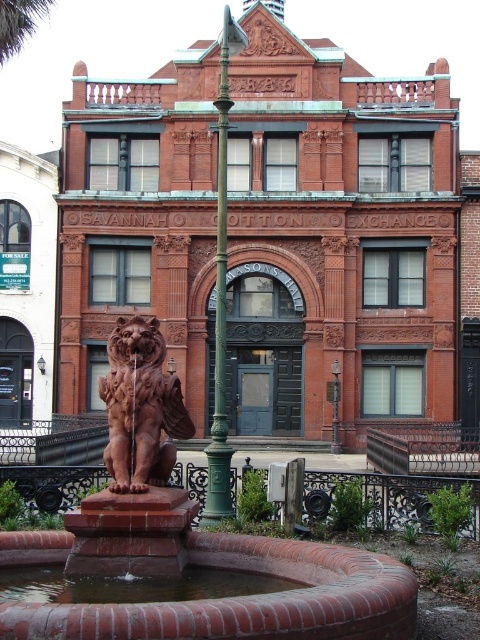
You are a tour guide leading a group near the Savannah Cotton Exchange. You want to ensure that your group can comfortably walk between the matte brown lion at center and the green cast iron pole at center. The group requires a minimum of 10 meters of space to move safely. Can the group safely pass through the area between these two objects?

The distance between the matte brown lion at center and the green cast iron pole at center is 13.07 meters, which exceeds the required 10 meters. Therefore, the group can safely pass through the area between these two objects.

You are a visitor standing in front of the historic Savannah Cotton Exchange building. You notice two poles in the scene. Which pole, the green cast iron pole at center or the green metal pole at center, is located higher up?

The green cast iron pole at center is positioned over the green metal pole at center, so it is located higher up.